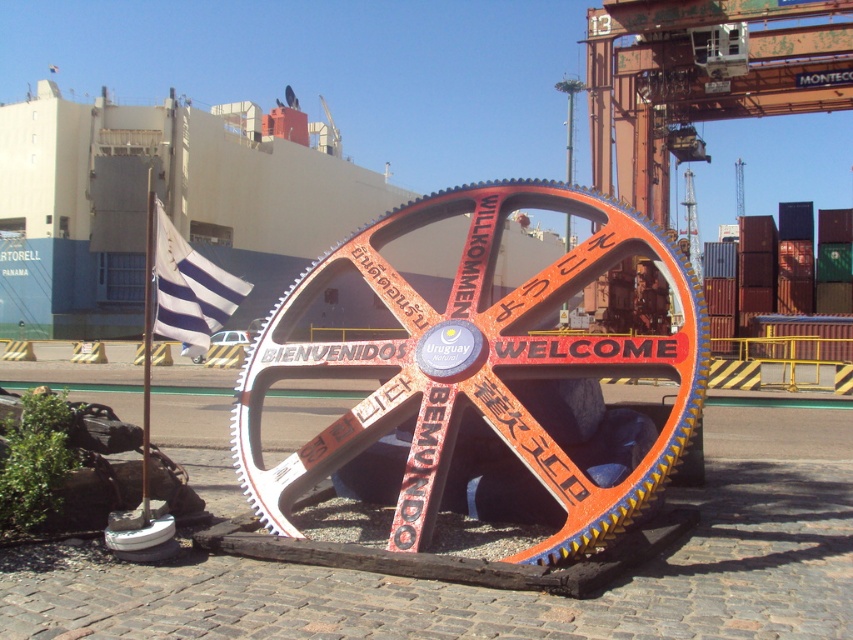
Question: Among these points, which one is nearest to the camera?

Choices:
 (A) pos(199,298)
 (B) pos(344,256)

Answer: (A)

Question: Does orange painted metal gear at center lie behind black rubber tire at center?

Choices:
 (A) no
 (B) yes

Answer: (A)

Question: Does orange painted metal gear at center appear on the left side of white striped fabric at left?

Choices:
 (A) yes
 (B) no

Answer: (B)

Question: Which point is farther to the camera?

Choices:
 (A) (171, 317)
 (B) (202, 362)

Answer: (B)

Question: Based on their relative distances, which object is farther from the white striped fabric at left?

Choices:
 (A) orange painted metal gear at center
 (B) black rubber tire at center

Answer: (B)

Question: Is orange painted metal gear at center thinner than white striped fabric at left?

Choices:
 (A) yes
 (B) no

Answer: (B)